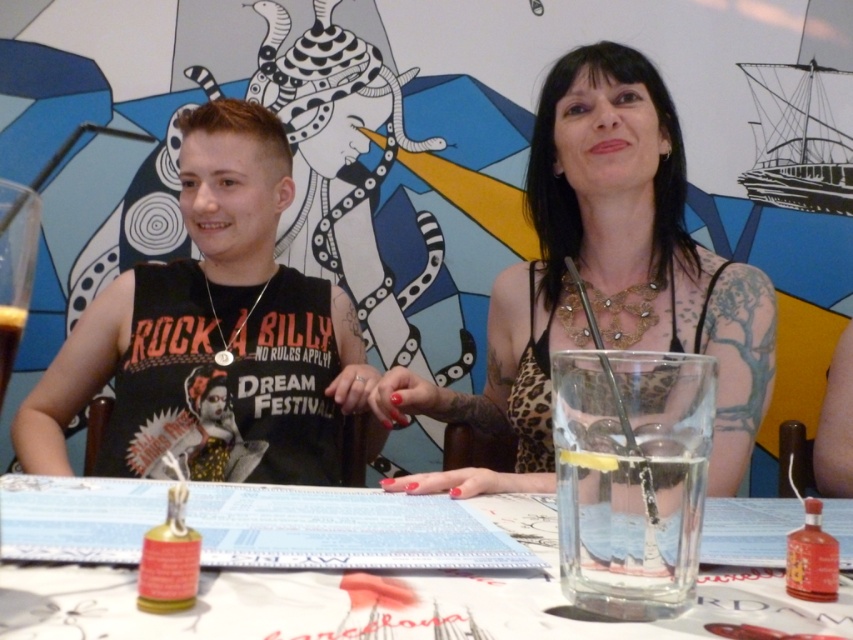
Question: Which of the following is the farthest from the observer?

Choices:
 (A) clear plastic glass at center
 (B) black matte tank top at left
 (C) clear glass at left
 (D) leopard print dress at center

Answer: (B)

Question: Which point is closer to the camera?

Choices:
 (A) (16, 307)
 (B) (763, 376)

Answer: (A)

Question: Does leopard print dress at center appear over clear plastic glass at center?

Choices:
 (A) yes
 (B) no

Answer: (A)

Question: Based on their relative distances, which object is nearer to the clear plastic glass at center?

Choices:
 (A) leopard print dress at center
 (B) clear glass at left
 (C) black matte tank top at left

Answer: (B)

Question: Does leopard print dress at center have a lesser width compared to clear plastic glass at center?

Choices:
 (A) no
 (B) yes

Answer: (B)

Question: Does black matte tank top at left have a smaller size compared to clear plastic glass at center?

Choices:
 (A) yes
 (B) no

Answer: (B)